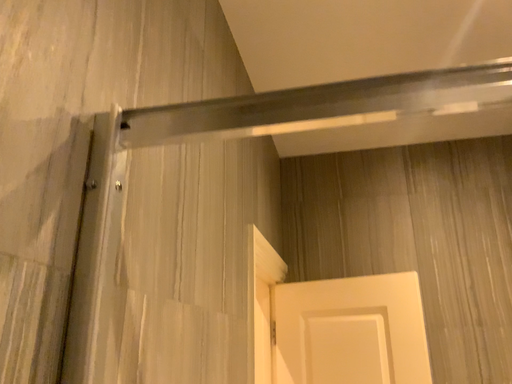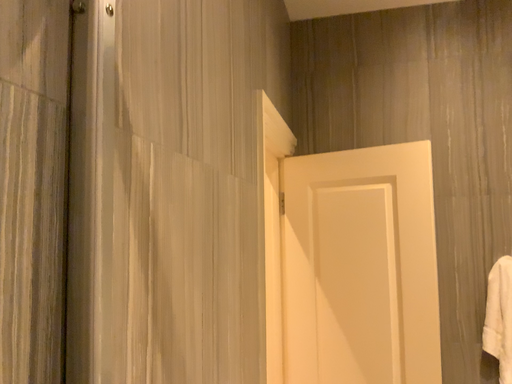
Question: Which way did the camera rotate in the video?

Choices:
 (A) rotated downward
 (B) rotated upward

Answer: (A)